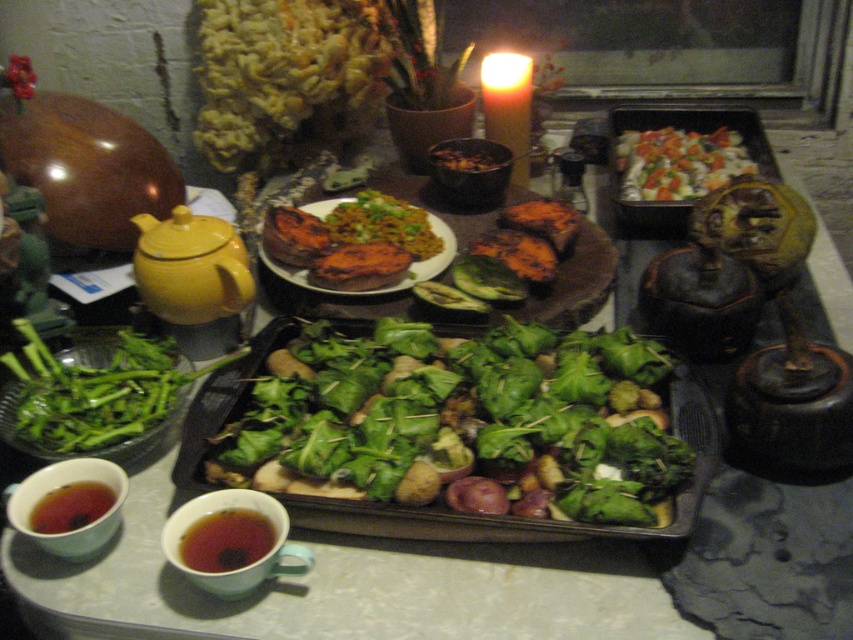
Question: Can you confirm if golden-brown baked potato at center is wider than brown liquid tea at lower left?

Choices:
 (A) no
 (B) yes

Answer: (B)

Question: Among these points, which one is farthest from the camera?

Choices:
 (A) (712, 156)
 (B) (387, 492)

Answer: (A)

Question: Is green leafymaterial/texturevegetable at center wider than golden-brown baked potato at center?

Choices:
 (A) no
 (B) yes

Answer: (B)

Question: Is golden-brown baked potato at center wider than brown matte cup at lower left?

Choices:
 (A) yes
 (B) no

Answer: (A)

Question: Which point is closer to the camera?

Choices:
 (A) golden-brown baked potato at center
 (B) brown matte cup at lower left

Answer: (B)

Question: Which point is closer to the camera taking this photo?

Choices:
 (A) (395, 236)
 (B) (229, 468)
 (C) (254, 515)
 (D) (672, 193)

Answer: (C)